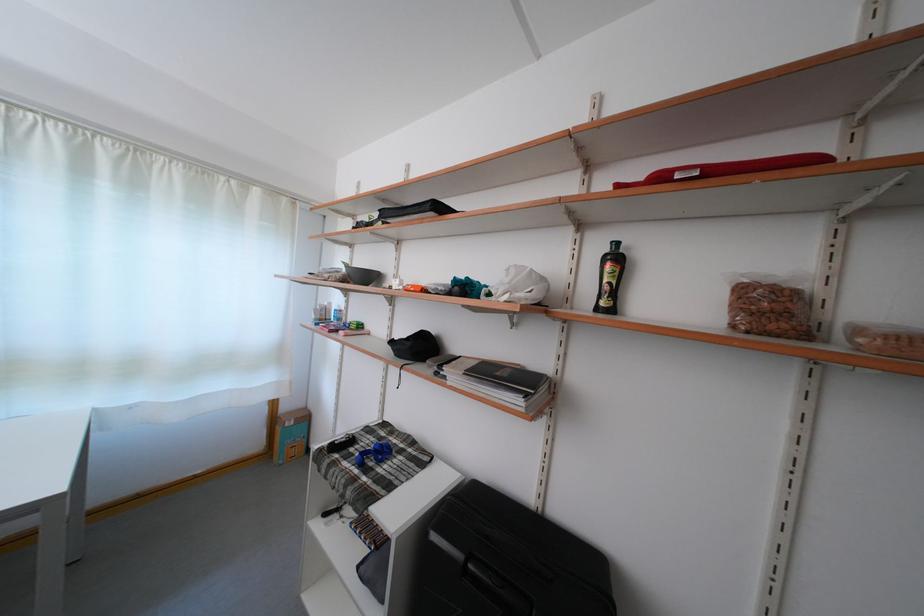
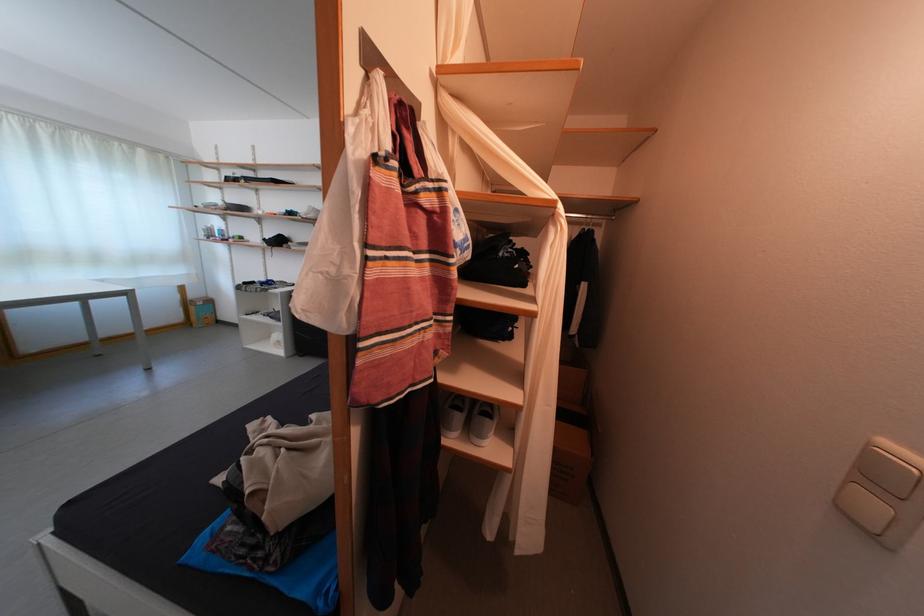
Where in the second image is the point corresponding to point (293, 415) from the first image?

(201, 302)